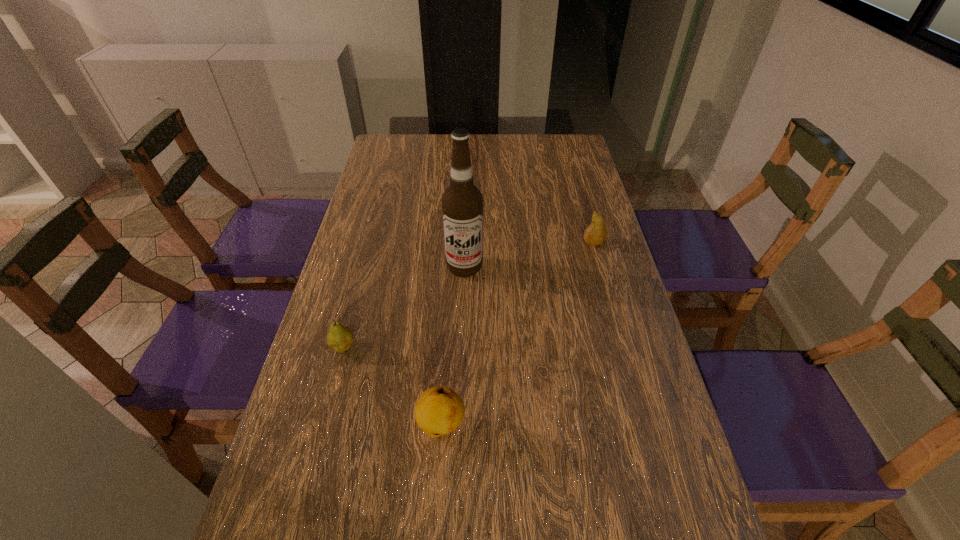
Where is `free space located on the back of the farthest object`? Image resolution: width=960 pixels, height=540 pixels. free space located on the back of the farthest object is located at coordinates (578, 186).

This screenshot has width=960, height=540. I want to click on vacant space located on the front of the shortest pear, so click(324, 417).

Where is `object that is at the left edge`? This screenshot has height=540, width=960. object that is at the left edge is located at coordinates (340, 338).

You are a GUI agent. You are given a task and a screenshot of the screen. Output one action in this format:
    pyautogui.click(x=<x>, y=<y>)
    Task: Click on the object that is positioned at the right edge
    The height and width of the screenshot is (540, 960).
    Given the screenshot: What is the action you would take?
    pyautogui.click(x=596, y=233)

In order to click on free spot at the far edge of the desktop in this screenshot , I will do `click(428, 163)`.

Locate an element on the screen. The image size is (960, 540). vacant region at the left edge is located at coordinates (342, 437).

At what (x,y) coordinates should I click in order to perform the action: click on vacant space at the right edge. Please return your answer as a coordinate pair (x, y). The width and height of the screenshot is (960, 540). Looking at the image, I should click on (636, 417).

This screenshot has width=960, height=540. I want to click on vacant space at the far left corner of the desktop, so click(x=387, y=149).

At what (x,y) coordinates should I click in order to perform the action: click on free spot at the far right corner of the desktop. Please return your answer as a coordinate pair (x, y). Looking at the image, I should click on (580, 137).

Find the location of a particular element. free space between the farthest pear and the nearest object is located at coordinates (517, 334).